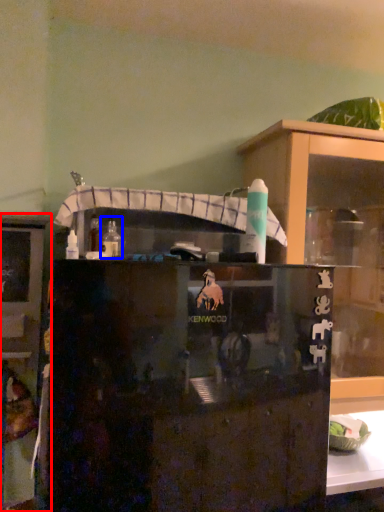
Question: Which object appears closest to the camera in this image, cabinetry (highlighted by a red box) or bottle (highlighted by a blue box)?

Choices:
 (A) cabinetry
 (B) bottle

Answer: (B)